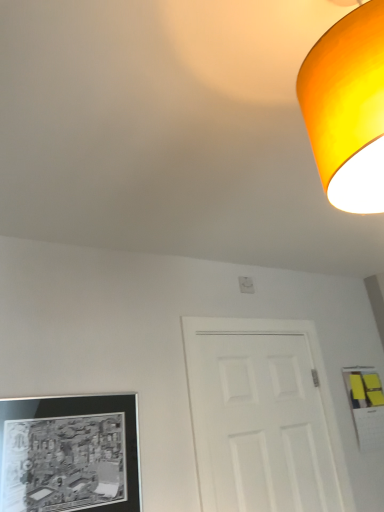
Question: From a real-world perspective, is black matte picture frame at lower left located beneath matte orange lampshade at upper right?

Choices:
 (A) yes
 (B) no

Answer: (A)

Question: Are black matte picture frame at lower left and matte orange lampshade at upper right located far from each other?

Choices:
 (A) no
 (B) yes

Answer: (B)

Question: Does black matte picture frame at lower left come behind matte orange lampshade at upper right?

Choices:
 (A) yes
 (B) no

Answer: (A)

Question: Is black matte picture frame at lower left to the right of matte orange lampshade at upper right from the viewer's perspective?

Choices:
 (A) no
 (B) yes

Answer: (A)

Question: Can you confirm if black matte picture frame at lower left is thinner than matte orange lampshade at upper right?

Choices:
 (A) no
 (B) yes

Answer: (B)

Question: Considering the relative positions of white matte door at center and black matte picture frame at lower left in the image provided, is white matte door at center to the left or to the right of black matte picture frame at lower left?

Choices:
 (A) right
 (B) left

Answer: (A)

Question: Is point (235, 382) positioned closer to the camera than point (79, 458)?

Choices:
 (A) closer
 (B) farther

Answer: (B)

Question: From a real-world perspective, is white matte door at center physically located above or below black matte picture frame at lower left?

Choices:
 (A) below
 (B) above

Answer: (B)

Question: Looking at the image, does white matte door at center seem bigger or smaller compared to black matte picture frame at lower left?

Choices:
 (A) small
 (B) big

Answer: (B)

Question: Is matte orange lampshade at upper right in front of or behind white matte door at center in the image?

Choices:
 (A) behind
 (B) front

Answer: (B)

Question: Is matte orange lampshade at upper right bigger or smaller than white matte door at center?

Choices:
 (A) small
 (B) big

Answer: (A)

Question: Would you say matte orange lampshade at upper right is to the left or to the right of white matte door at center in the picture?

Choices:
 (A) right
 (B) left

Answer: (B)

Question: Is matte orange lampshade at upper right wider or thinner than white matte door at center?

Choices:
 (A) wide
 (B) thin

Answer: (A)

Question: From the image's perspective, is matte orange lampshade at upper right positioned above or below black matte picture frame at lower left?

Choices:
 (A) below
 (B) above

Answer: (B)

Question: Would you say matte orange lampshade at upper right is inside or outside black matte picture frame at lower left?

Choices:
 (A) outside
 (B) inside

Answer: (A)